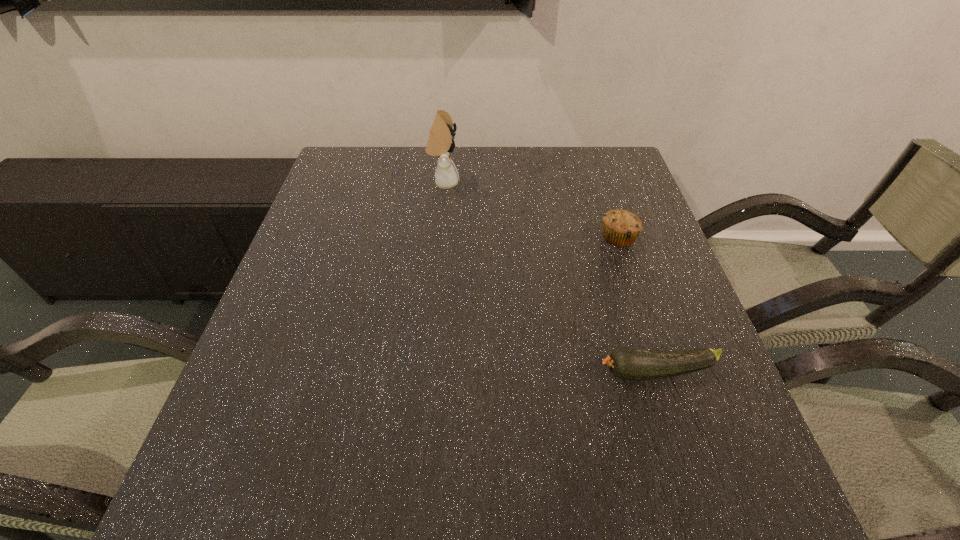
Identify the location of free location located at the blossom end of the shortest object. (523, 372).

Where is `object positioned at the far edge`? object positioned at the far edge is located at coordinates (440, 143).

Locate an element on the screen. Image resolution: width=960 pixels, height=540 pixels. muffin that is at the right edge is located at coordinates (621, 228).

I want to click on zucchini present at the right edge, so click(626, 363).

In the image, there is a desktop. Where is `vacant space at the far edge`? The height and width of the screenshot is (540, 960). vacant space at the far edge is located at coordinates point(407,174).

What are the coordinates of `free space at the near edge` in the screenshot? It's located at (417, 471).

Find the location of a particular element. vacant space at the left edge of the desktop is located at coordinates (311, 404).

Where is `vacant area at the right edge`? vacant area at the right edge is located at coordinates (684, 335).

Find the location of a particular element. vacant space at the near right corner is located at coordinates (716, 516).

Where is `free space between the shortest object and the tallest object`? free space between the shortest object and the tallest object is located at coordinates (550, 277).